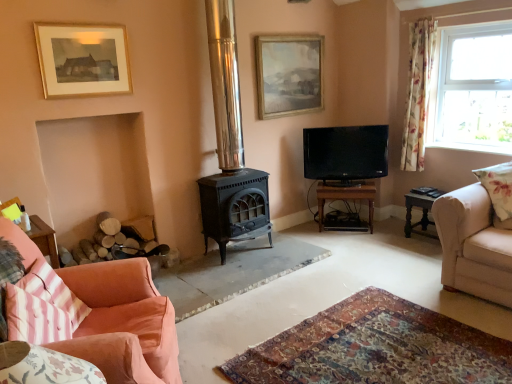
I want to click on vacant area on top of wooden picture frame at upper center, which ranks as the first picture frame in back-to-front order (from a real-world perspective), so click(295, 31).